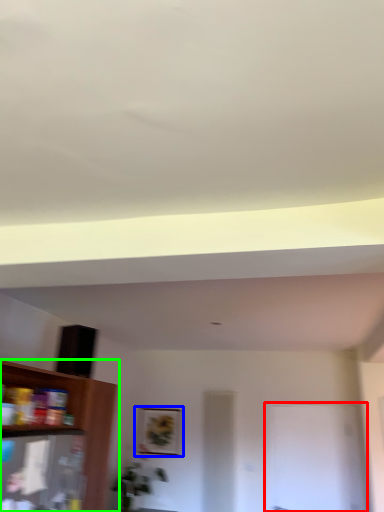
Question: Which is nearer to the glass door (highlighted by a red box)? picture frame (highlighted by a blue box) or shelf (highlighted by a green box).

Choices:
 (A) picture frame
 (B) shelf

Answer: (A)